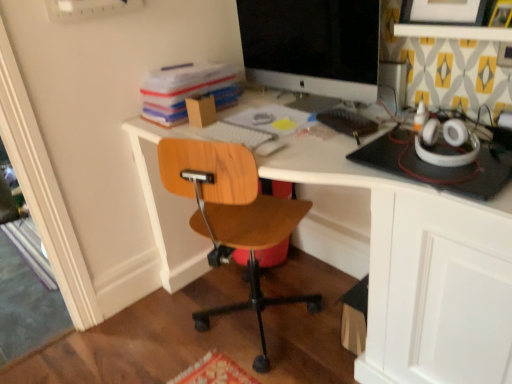
Identify the location of vacant region to the left of wooden chair at center. The height and width of the screenshot is (384, 512). (163, 330).